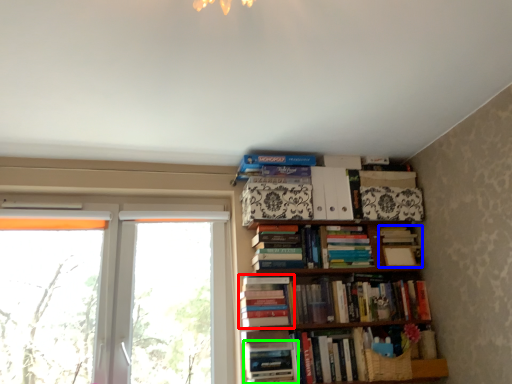
Question: Which is nearer to the book (highlighted by a red box)? book (highlighted by a blue box) or book (highlighted by a green box).

Choices:
 (A) book
 (B) book

Answer: (B)